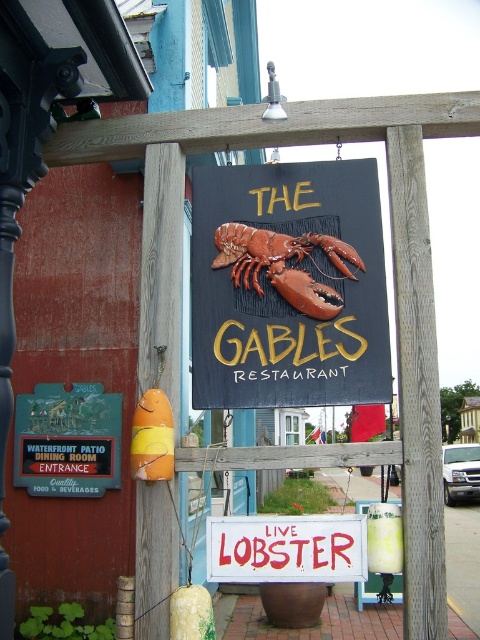
Question: Which is farther from the matte wooden signboard with lobster at center?

Choices:
 (A) red painted wood sign at center
 (B) black plastic sign at lower left

Answer: (B)

Question: Which point is closer to the camera?

Choices:
 (A) (265, 525)
 (B) (67, 435)
 (C) (331, 308)

Answer: (A)

Question: Can you confirm if matte wooden signboard with lobster at center is wider than black plastic sign at lower left?

Choices:
 (A) no
 (B) yes

Answer: (B)

Question: Which of these objects is positioned farthest from the red painted wood sign at center?

Choices:
 (A) shiny red lobster at center
 (B) black plastic sign at lower left

Answer: (B)

Question: Does matte wooden signboard with lobster at center lie behind shiny red lobster at center?

Choices:
 (A) yes
 (B) no

Answer: (B)

Question: Is red painted wood sign at center below shiny red lobster at center?

Choices:
 (A) no
 (B) yes

Answer: (B)